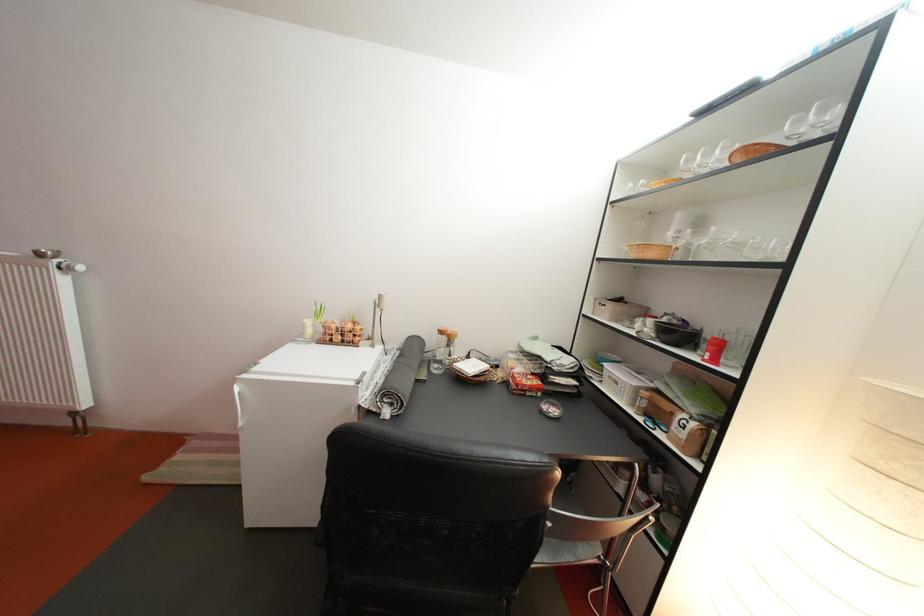
You are a GUI agent. You are given a task and a screenshot of the screen. Output one action in this format:
    pyautogui.click(x=<x>, y=<y>)
    Task: Click on the glass bottle
    The height and width of the screenshot is (616, 924).
    Given the screenshot: What is the action you would take?
    pyautogui.click(x=439, y=352)